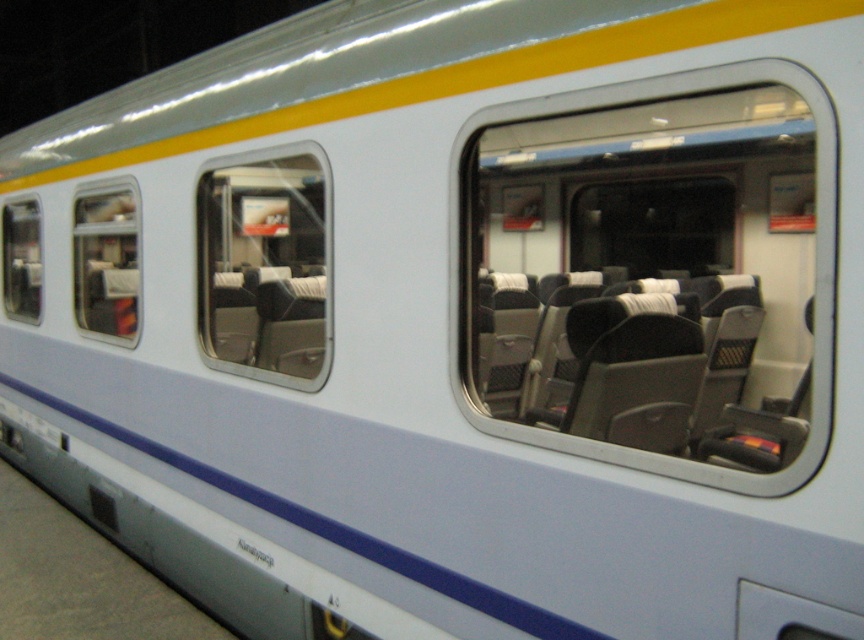
You are a passenger sitting inside the train car and want to look outside through the windows. Which window, the transparent glass window at center or the transparent glass window at left, is located lower from the top of the train car?

The transparent glass window at center is positioned under the transparent glass window at left, meaning it is lower from the top of the train car.

From the picture: You are a passenger on the train and want to look outside through the windows. Which window should you choose if you want to see the landscape clearly without any obstruction? The options are the clear glass window at center and the transparent glass window at center.

Both the clear glass window at center and the transparent glass window at center are suitable for viewing the landscape clearly as both are described as clear or transparent. However, according to the description, the clear glass window at center is positioned to the right of the transparent glass window at center. Since both are clear, either can be used, but their positions might affect your view depending on where you are seated.

You are a passenger on the train and want to look outside through the windows. Which window, the transparent glass window at center or the transparent glass window at left, allows you to see a taller view of the landscape outside?

The transparent glass window at center has a greater height compared to the transparent glass window at left, so it allows you to see a taller view of the landscape outside.